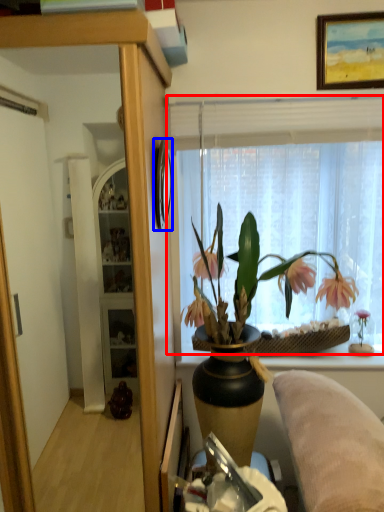
Question: Among these objects, which one is farthest to the camera, window (highlighted by a red box) or picture frame (highlighted by a blue box)?

Choices:
 (A) window
 (B) picture frame

Answer: (A)